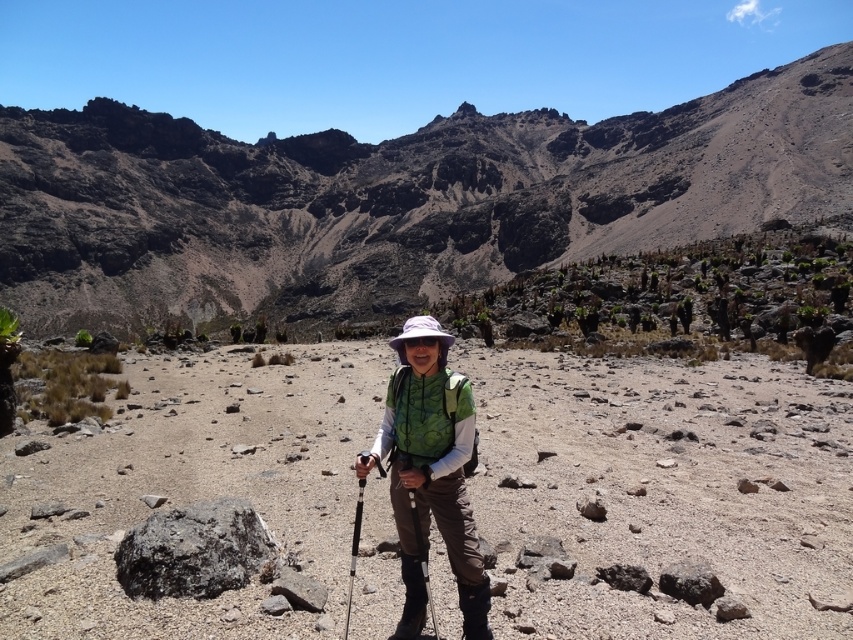
Question: Among these objects, which one is farthest from the camera?

Choices:
 (A) matte black ski pole at center
 (B) dull gray rock at center
 (C) green fabric vest at center
 (D) silver metallic ski pole at center

Answer: (B)

Question: Which of the following is the closest to the observer?

Choices:
 (A) (460, 595)
 (B) (820, 493)
 (C) (358, 481)
 (D) (410, 502)

Answer: (A)

Question: Does brown rocky desert at center appear on the left side of green fabric vest at center?

Choices:
 (A) no
 (B) yes

Answer: (A)

Question: From the image, what is the correct spatial relationship of dull gray rock at center in relation to green fabric vest at center?

Choices:
 (A) right
 (B) left

Answer: (A)

Question: Which is nearer to the brown rocky desert at center?

Choices:
 (A) matte black ski pole at center
 (B) green fabric vest at center

Answer: (B)

Question: Is brown rocky desert at center above green fabric vest at center?

Choices:
 (A) no
 (B) yes

Answer: (A)